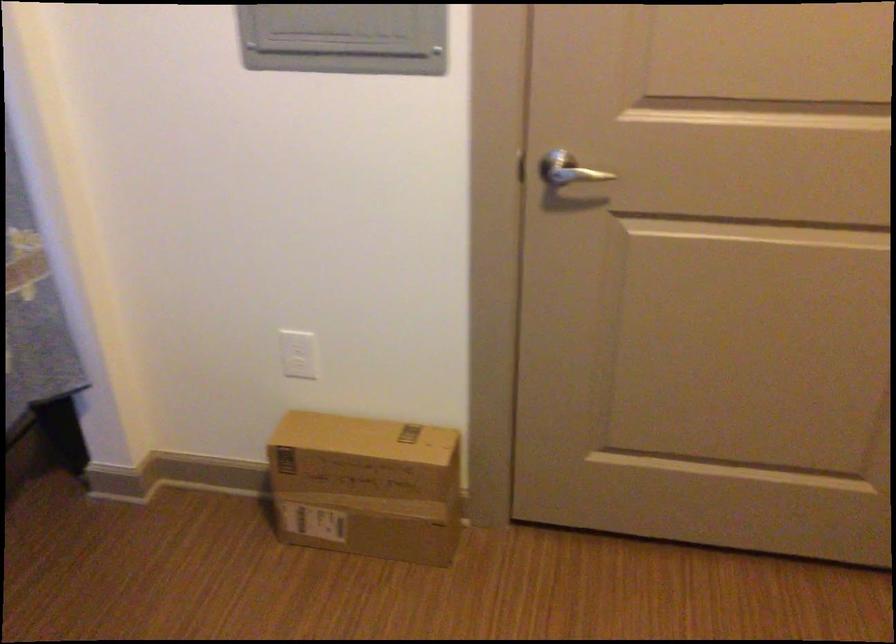
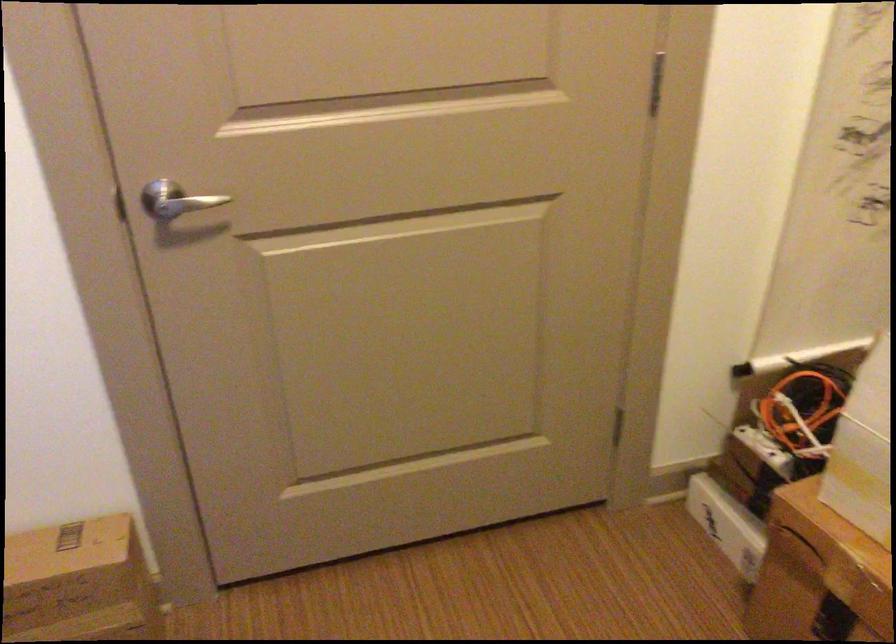
Where in the second image is the point corresponding to point 563,164 from the first image?

(176, 200)